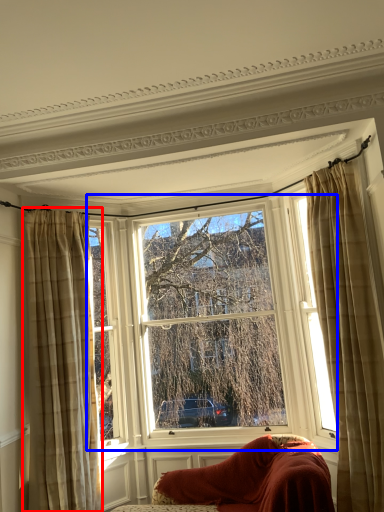
Question: Among these objects, which one is farthest to the camera, curtain (highlighted by a red box) or window (highlighted by a blue box)?

Choices:
 (A) curtain
 (B) window

Answer: (B)